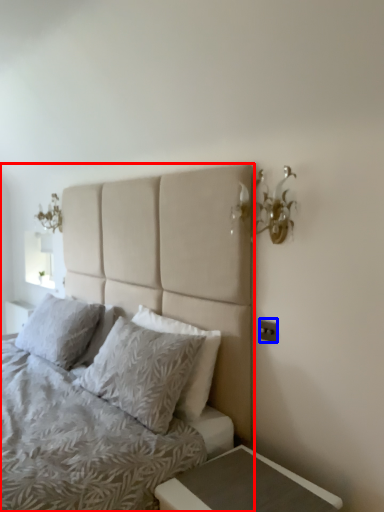
Question: Among these objects, which one is farthest to the camera, bed (highlighted by a red box) or electric outlet (highlighted by a blue box)?

Choices:
 (A) bed
 (B) electric outlet

Answer: (B)